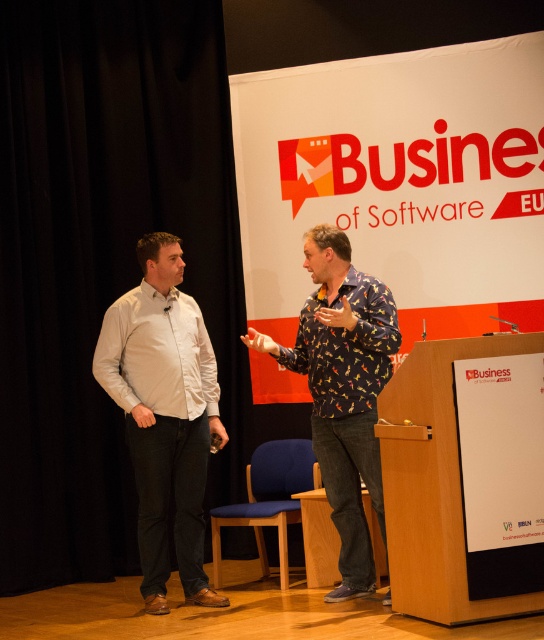
Between white cotton shirt at left and printed fabric shirt at center, which one appears on the left side from the viewer's perspective?

white cotton shirt at left is more to the left.

Who is positioned more to the right, white cotton shirt at left or printed fabric shirt at center?

printed fabric shirt at center

Does point (190, 413) come behind point (324, 291)?

Yes, point (190, 413) is farther from viewer.

Identify the location of white cotton shirt at left. (x=163, y=413).